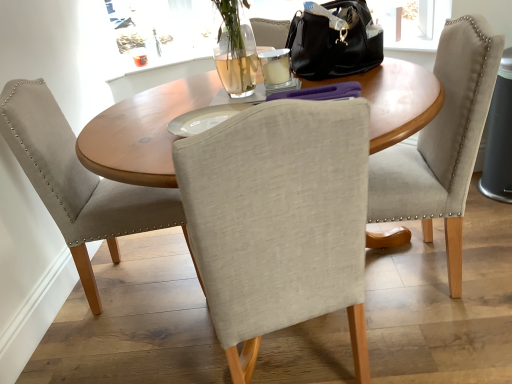
Question: Considering the relative sizes of light gray fabric chair at center, acting as the 2th chair starting from the left, and wooden table at center in the image provided, is light gray fabric chair at center, acting as the 2th chair starting from the left, bigger than wooden table at center?

Choices:
 (A) yes
 (B) no

Answer: (B)

Question: Can we say light gray fabric chair at center, which appears as the 1th chair when viewed from the right, lies outside wooden table at center?

Choices:
 (A) no
 (B) yes

Answer: (B)

Question: Is light gray fabric chair at center, acting as the 2th chair starting from the left, far away from wooden table at center?

Choices:
 (A) no
 (B) yes

Answer: (A)

Question: From a real-world perspective, is light gray fabric chair at center, acting as the 2th chair starting from the left, over wooden table at center?

Choices:
 (A) no
 (B) yes

Answer: (A)

Question: Is light gray fabric chair at center, which appears as the 1th chair when viewed from the right, next to wooden table at center and touching it?

Choices:
 (A) no
 (B) yes

Answer: (A)

Question: Is light gray fabric chair at center, acting as the 2th chair starting from the left, aimed at wooden table at center?

Choices:
 (A) yes
 (B) no

Answer: (B)

Question: Does wooden table at center appear on the right side of light gray fabric chair at left, the 2th chair positioned from the right?

Choices:
 (A) yes
 (B) no

Answer: (A)

Question: Would you say wooden table at center is a long distance from light gray fabric chair at left, placed as the 1th chair when sorted from left to right?

Choices:
 (A) yes
 (B) no

Answer: (B)

Question: Is wooden table at center wider than light gray fabric chair at left, the 2th chair positioned from the right?

Choices:
 (A) yes
 (B) no

Answer: (B)

Question: Are wooden table at center and light gray fabric chair at left, placed as the 1th chair when sorted from left to right, beside each other?

Choices:
 (A) no
 (B) yes

Answer: (A)

Question: Is wooden table at center shorter than light gray fabric chair at left, the 2th chair positioned from the right?

Choices:
 (A) yes
 (B) no

Answer: (B)

Question: Is wooden table at center surrounding light gray fabric chair at left, the 2th chair positioned from the right?

Choices:
 (A) no
 (B) yes

Answer: (A)

Question: From the image's perspective, does black leather handbag at upper center appear lower than wooden table at center?

Choices:
 (A) no
 (B) yes

Answer: (A)